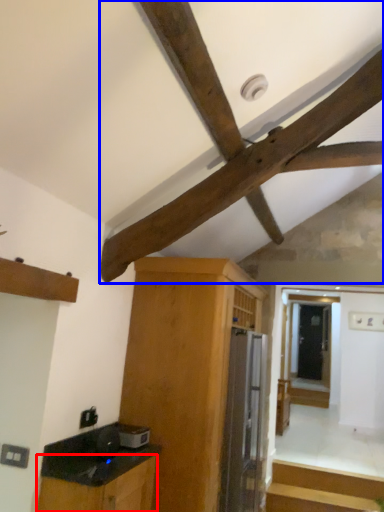
Question: Which of the following is the farthest to the observer, cabinetry (highlighted by a red box) or exhaust hood (highlighted by a blue box)?

Choices:
 (A) cabinetry
 (B) exhaust hood

Answer: (B)